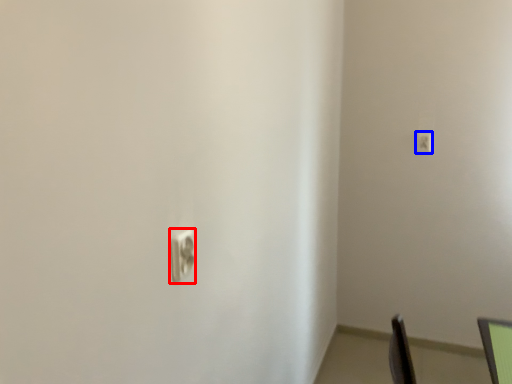
Question: Among these objects, which one is farthest to the camera, light switch (highlighted by a red box) or light switch (highlighted by a blue box)?

Choices:
 (A) light switch
 (B) light switch

Answer: (B)